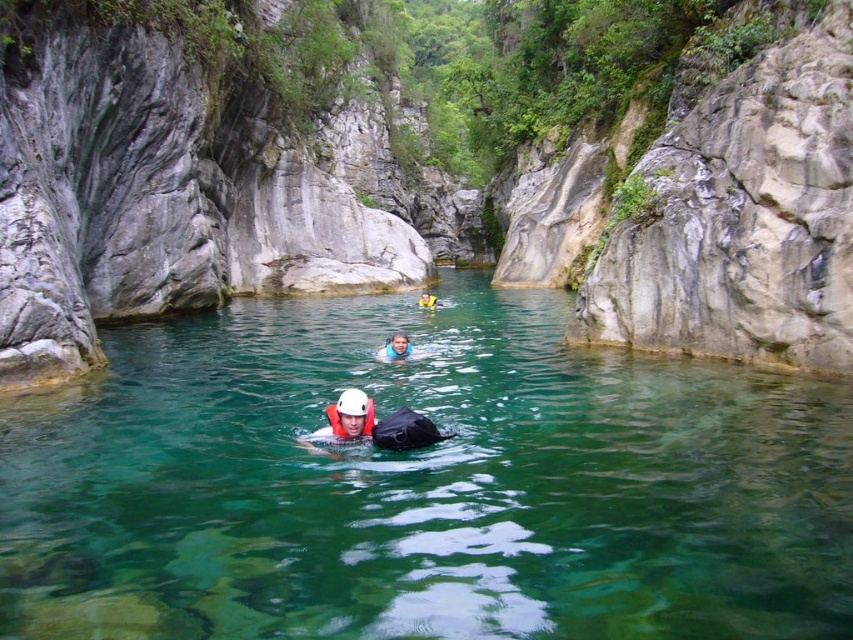
Does orange life jacket at center have a greater width compared to yellow life vest at center?

Yes.

Does orange life jacket at center have a lesser width compared to yellow life vest at center?

Incorrect, orange life jacket at center's width is not less than yellow life vest at center's.

Between point (387, 353) and point (421, 296), which one is positioned in front?

Point (387, 353) is more forward.

At what (x,y) coordinates should I click in order to perform the action: click on orange life jacket at center. Please return your answer as a coordinate pair (x, y). The image size is (853, 640). Looking at the image, I should click on (396, 348).

Who is higher up, white matte helmet at center or blue fabric at center?

Positioned higher is blue fabric at center.

Is white matte helmet at center bigger than blue fabric at center?

No, white matte helmet at center is not bigger than blue fabric at center.

Who is more distant from viewer, (337, 419) or (387, 337)?

Point (387, 337)

This screenshot has width=853, height=640. Find the location of `white matte helmet at center`. white matte helmet at center is located at coordinates (344, 420).

Does white matte helmet at center appear on the left side of white matte life jacket at center?

Indeed, white matte helmet at center is positioned on the left side of white matte life jacket at center.

Consider the image. Measure the distance between point (360, 436) and camera.

Point (360, 436) and camera are 66.28 feet apart from each other.

Describe the element at coordinates (344, 420) in the screenshot. I see `white matte helmet at center` at that location.

You are a GUI agent. You are given a task and a screenshot of the screen. Output one action in this format:
    pyautogui.click(x=<x>, y=<y>)
    Task: Click on the white matte helmet at center
    The width and height of the screenshot is (853, 640).
    Given the screenshot: What is the action you would take?
    pyautogui.click(x=344, y=420)